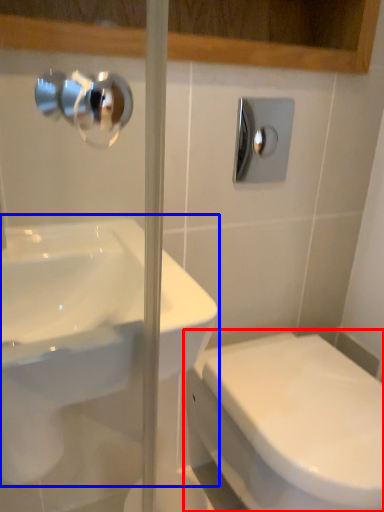
Question: Among these objects, which one is nearest to the camera, toilet (highlighted by a red box) or sink (highlighted by a blue box)?

Choices:
 (A) toilet
 (B) sink

Answer: (B)